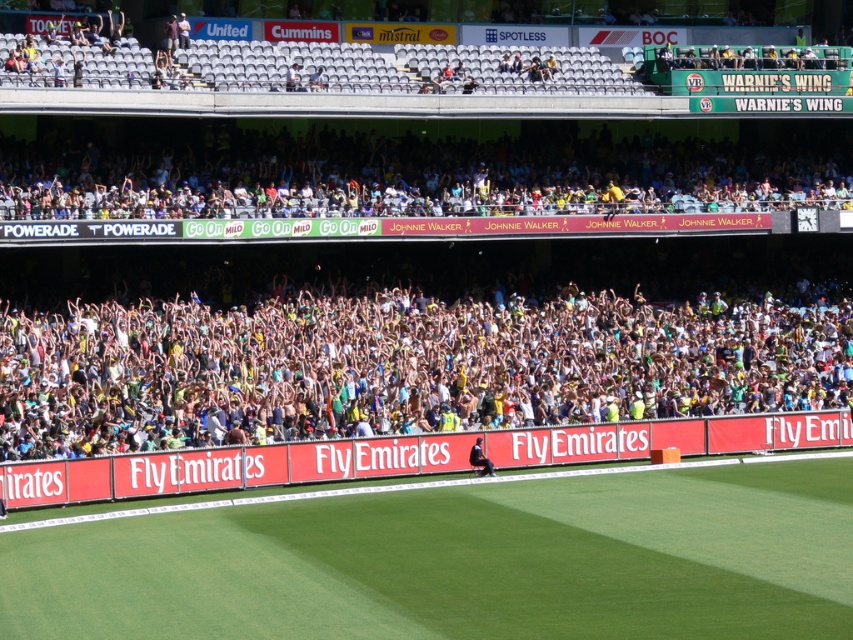
Question: Does green grass football field at center appear under multicolored plastic crowd at upper center?

Choices:
 (A) no
 (B) yes

Answer: (B)

Question: Observing the image, what is the correct spatial positioning of multicolored plastic crowd at upper center in reference to dark blue uniform at center?

Choices:
 (A) above
 (B) below

Answer: (A)

Question: Which of these objects is positioned farthest from the yellow-green jersey crowd at center?

Choices:
 (A) multicolored plastic crowd at upper center
 (B) dark blue uniform at center

Answer: (B)

Question: Which point is closer to the camera?

Choices:
 (A) (485, 468)
 (B) (281, 352)
 (C) (769, 497)

Answer: (C)

Question: Does yellow-green jersey crowd at center appear on the left side of dark blue uniform at center?

Choices:
 (A) yes
 (B) no

Answer: (B)

Question: Considering the real-world distances, which object is closest to the yellow-green jersey crowd at center?

Choices:
 (A) green grass football field at center
 (B) multicolored plastic crowd at upper center
 (C) dark blue uniform at center

Answer: (B)